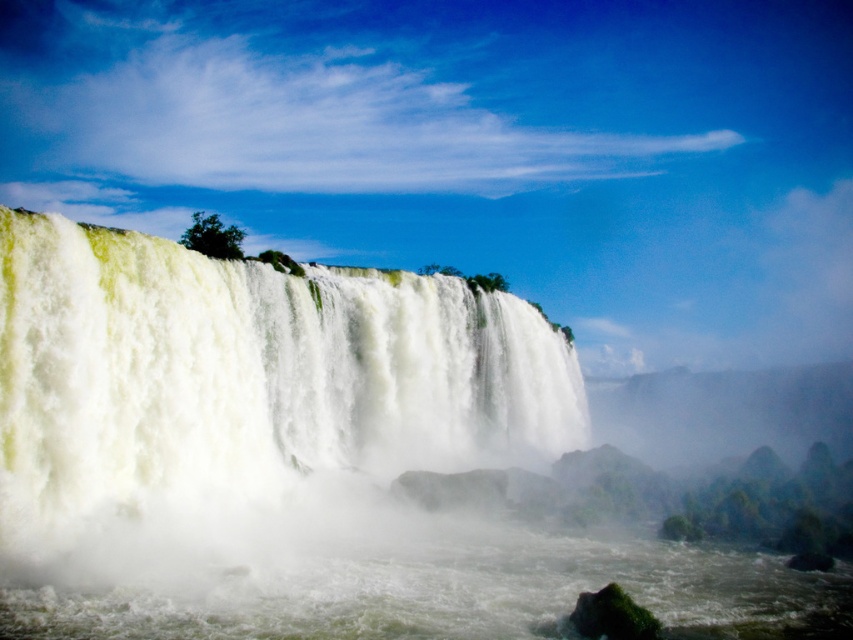
Who is positioned more to the left, white foamy water at center or white frothy water at lower center?

From the viewer's perspective, white foamy water at center appears more on the left side.

Between white foamy water at center and white frothy water at lower center, which one appears on the right side from the viewer's perspective?

white frothy water at lower center is more to the right.

Describe the element at coordinates (244, 401) in the screenshot. This screenshot has width=853, height=640. I see `white foamy water at center` at that location.

The image size is (853, 640). Identify the location of white foamy water at center. (244, 401).